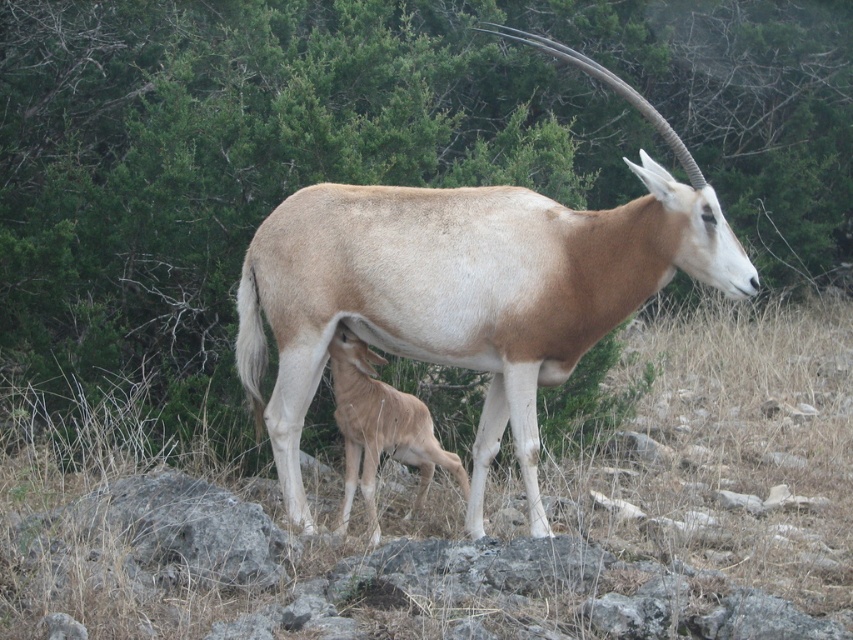
Question: Is light brown glossy antelope at center further to the viewer compared to light brown fur at center?

Choices:
 (A) yes
 (B) no

Answer: (B)

Question: Based on their relative distances, which object is farther from the light brown fur at center?

Choices:
 (A) light brown glossy antelope at center
 (B) brown dry grass at center

Answer: (B)

Question: Which object is the farthest from the brown dry grass at center?

Choices:
 (A) light brown glossy antelope at center
 (B) light brown fur at center

Answer: (A)

Question: Which of the following is the farthest from the observer?

Choices:
 (A) (561, 328)
 (B) (457, 554)

Answer: (A)

Question: Can you confirm if brown dry grass at center is positioned to the right of light brown fur at center?

Choices:
 (A) no
 (B) yes

Answer: (A)

Question: Does light brown glossy antelope at center appear on the right side of light brown fur at center?

Choices:
 (A) no
 (B) yes

Answer: (B)